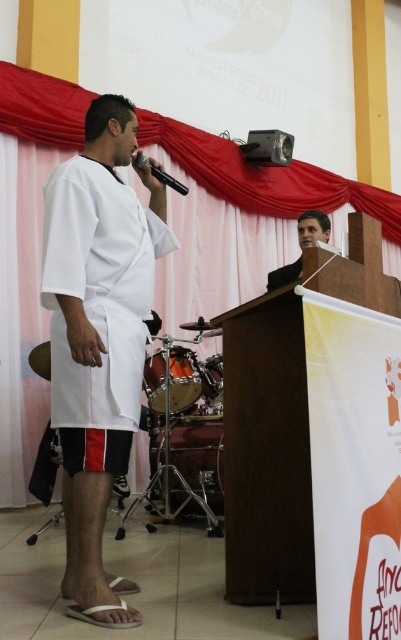
You are an event organizer who needs to adjust the stage setup. You want to move the shiny metallic drum at lower center closer to the black matte microphone at upper center. Which object should you move forward or backward to achieve this? Explain your reasoning.

To move the shiny metallic drum at lower center closer to the black matte microphone at upper center, you should move the shiny metallic drum at lower center backward. Since the shiny metallic drum at lower center is currently further to the viewer than the black matte microphone at upper center, moving it backward would bring it closer in position to the microphone.

You are standing in the audience looking at the stage. There are two points marked on the stage. The first point is at coordinate point (x=324, y=228) and the second point is at coordinate point (x=164, y=180). Which point is closer to you?

Point (x=164, y=180) is closer to you because it is less further to the camera than point (x=324, y=228).

You are a stagehand who needs to adjust the microphone stand to ensure it doesn not block the view of the white matte shirt at center and the shiny metallic drum at lower center. Which object should you position closer to the front of the stage?

The white matte shirt at center should be positioned closer to the front of the stage because it is placed over the shiny metallic drum at lower center, meaning it is already in a more forward position. Adjusting the microphone stand to avoid blocking this area would maintain visibility for both objects.